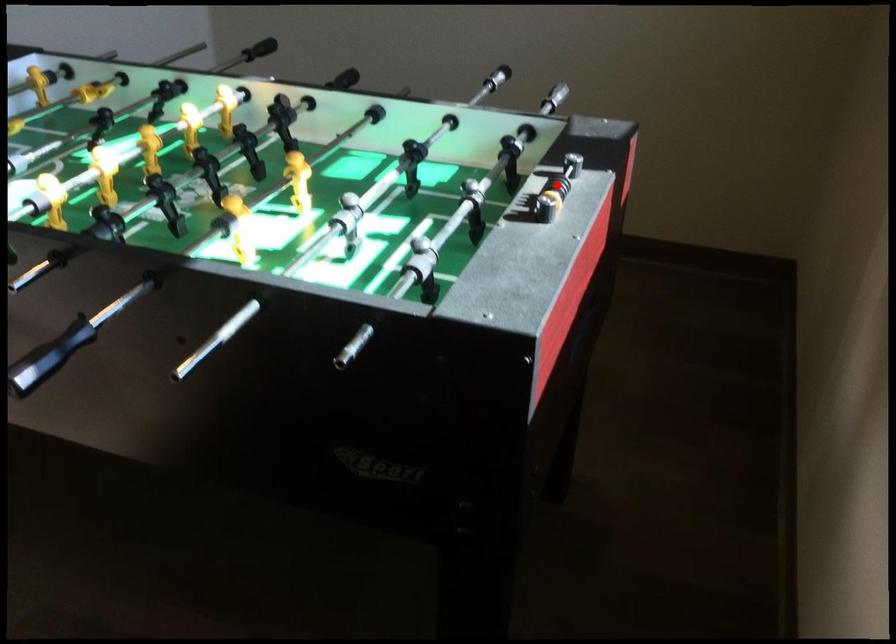
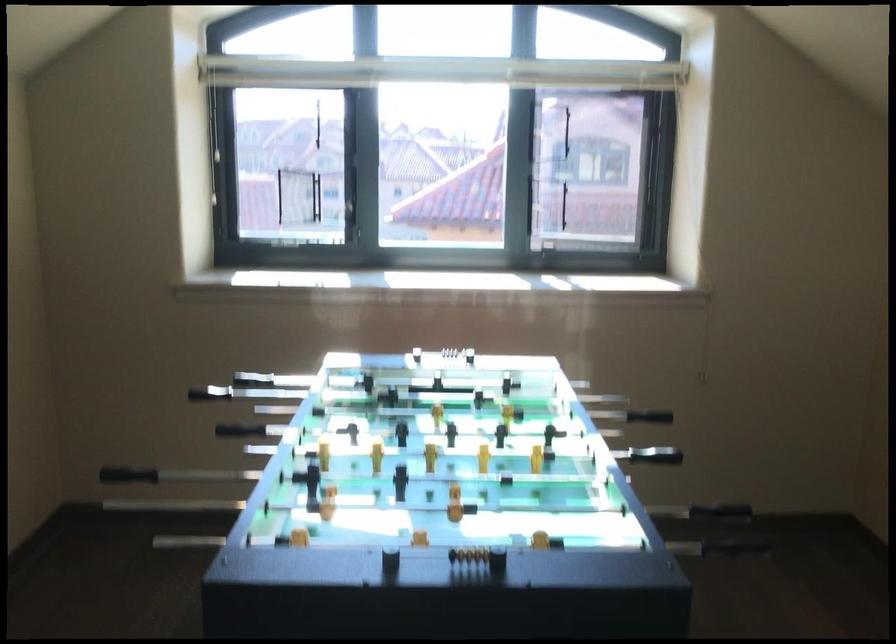
Locate, in the second image, the point that corresponds to the highlighted location in the first image.

(440, 354)